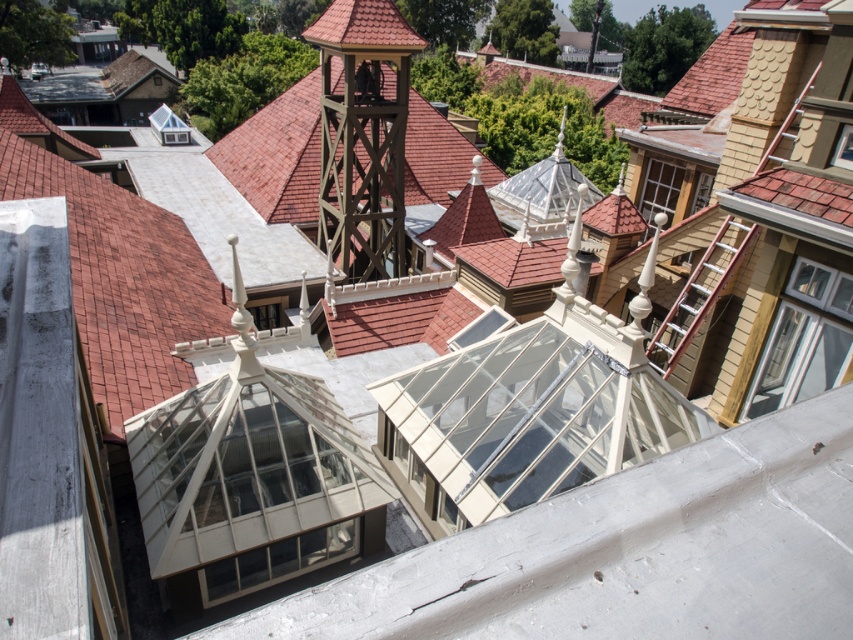
Question: Considering the relative positions of wooden bell tower at center and wooden ladder at upper right in the image provided, where is wooden bell tower at center located with respect to wooden ladder at upper right?

Choices:
 (A) above
 (B) below

Answer: (A)

Question: Is wooden bell tower at center closer to the viewer compared to wooden ladder at upper right?

Choices:
 (A) no
 (B) yes

Answer: (A)

Question: Is wooden bell tower at center to the right of wooden ladder at upper right from the viewer's perspective?

Choices:
 (A) yes
 (B) no

Answer: (B)

Question: Which object is closer to the camera taking this photo?

Choices:
 (A) wooden bell tower at center
 (B) wooden ladder at upper right

Answer: (B)

Question: Which of the following is the closest to the observer?

Choices:
 (A) (723, 220)
 (B) (381, 99)

Answer: (A)